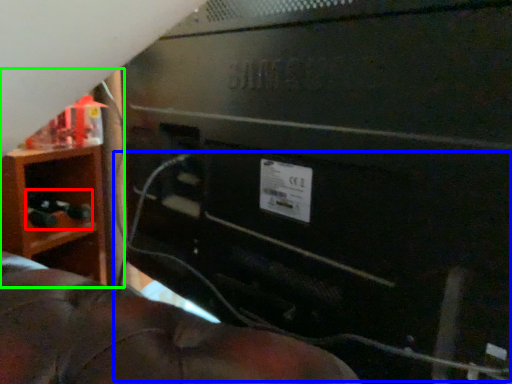
Question: Based on their relative distances, which object is nearer to toy (highlighted by a red box)? Choose from wire (highlighted by a blue box) and furniture (highlighted by a green box).

Choices:
 (A) wire
 (B) furniture

Answer: (B)